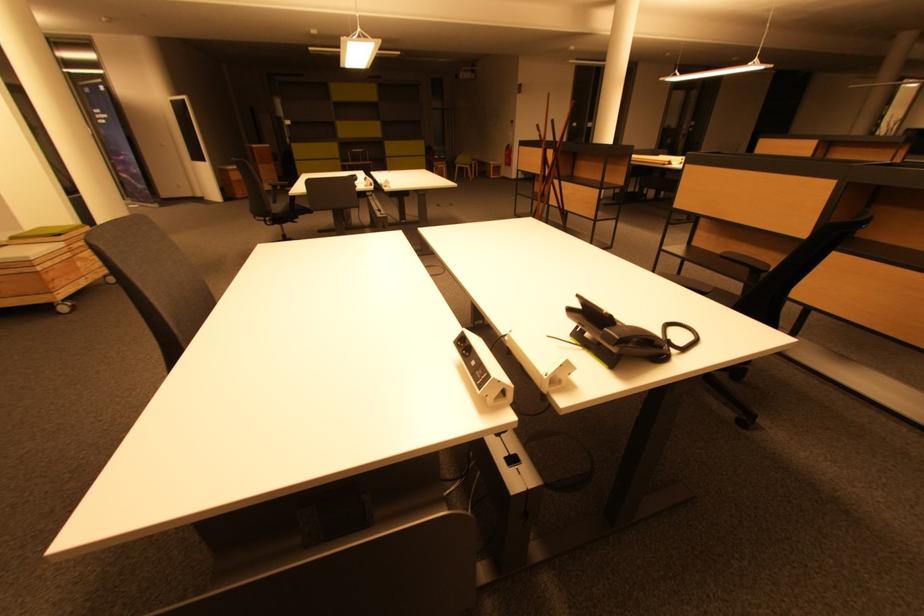
This screenshot has width=924, height=616. What do you see at coordinates (506, 155) in the screenshot?
I see `a red fire extinguisher` at bounding box center [506, 155].